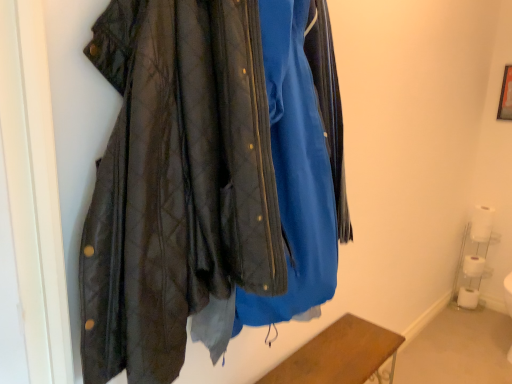
Question: Choose the correct answer: Is white matte toilet paper at lower right, the fourth toilet paper in the top-to-bottom sequence, inside white plastic shelf at lower right or outside it?

Choices:
 (A) inside
 (B) outside

Answer: (A)

Question: Based on their positions, is white matte toilet paper at lower right, positioned as the 1th toilet paper in bottom-to-top order, located to the left or right of white plastic shelf at lower right?

Choices:
 (A) right
 (B) left

Answer: (A)

Question: Which object is positioned closest to the white matte toilet paper at lower right, the fourth toilet paper in the top-to-bottom sequence?

Choices:
 (A) wooden frame at upper right
 (B) white matte toilet paper at lower right, which appears as the 1th toilet paper when viewed from the top
 (C) white paper towel at lower right, which is the 3th toilet paper in bottom-to-top order
 (D) white matte toilet paper at lower right, which is counted as the 3th toilet paper, starting from the top
 (E) brown wooden table at lower center

Answer: (D)

Question: Considering the real-world distances, which object is closest to the white plastic shelf at lower right?

Choices:
 (A) white matte toilet paper at lower right, which is the second toilet paper in bottom-to-top order
 (B) wooden frame at upper right
 (C) brown wooden table at lower center
 (D) white matte toilet paper at lower right, the fourth toilet paper positioned from the bottom
 (E) white paper towel at lower right, arranged as the second toilet paper when viewed from the top

Answer: (A)